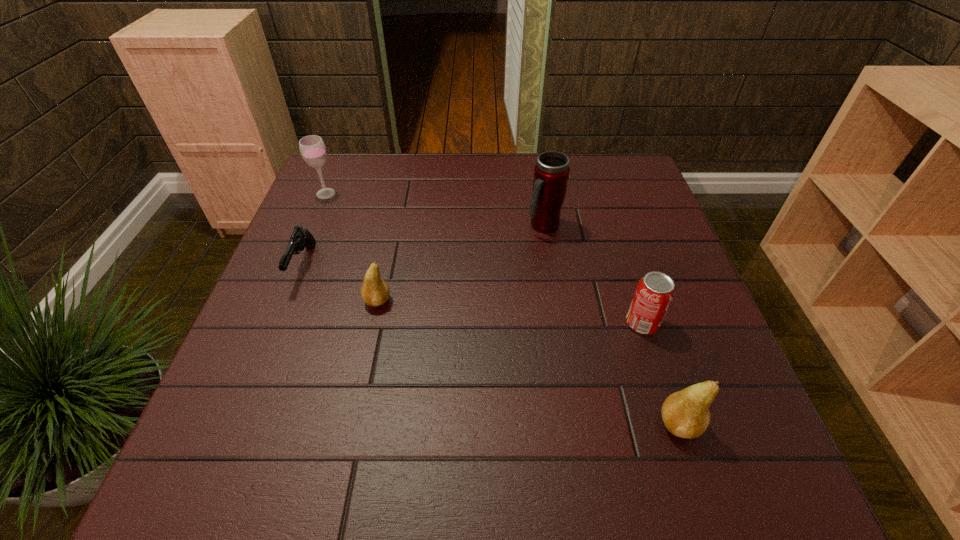
Identify the location of object that is the fourth closest to the shortest object. Image resolution: width=960 pixels, height=540 pixels. (655, 291).

The width and height of the screenshot is (960, 540). What are the coordinates of `free location that satisfies the following two spatial constraints: 1. at the end of the barrel of the nearer pear; 2. on the left side of the shortest object` in the screenshot? It's located at pyautogui.click(x=240, y=424).

Find the location of a particular element. This screenshot has width=960, height=540. vacant space that satisfies the following two spatial constraints: 1. on the front side of the wineglass; 2. on the right side of the left pear is located at coordinates (281, 301).

Find the location of `vacant region that satisfies the following two spatial constraints: 1. at the end of the barrel of the third object from left to right; 2. on the left side of the shortest object`. vacant region that satisfies the following two spatial constraints: 1. at the end of the barrel of the third object from left to right; 2. on the left side of the shortest object is located at coordinates (289, 301).

The height and width of the screenshot is (540, 960). I want to click on vacant region that satisfies the following two spatial constraints: 1. at the end of the barrel of the right pear; 2. on the right side of the gun, so click(x=240, y=424).

The width and height of the screenshot is (960, 540). I want to click on vacant region that satisfies the following two spatial constraints: 1. on the front side of the soda can; 2. on the right side of the right pear, so click(x=675, y=424).

This screenshot has height=540, width=960. Find the location of `free region that satisfies the following two spatial constraints: 1. on the side with the handle of the fifth nearest object; 2. on the right side of the right pear`. free region that satisfies the following two spatial constraints: 1. on the side with the handle of the fifth nearest object; 2. on the right side of the right pear is located at coordinates (575, 424).

Find the location of a particular element. vacant space that satisfies the following two spatial constraints: 1. at the end of the barrel of the farther pear; 2. on the left side of the shortest object is located at coordinates (289, 301).